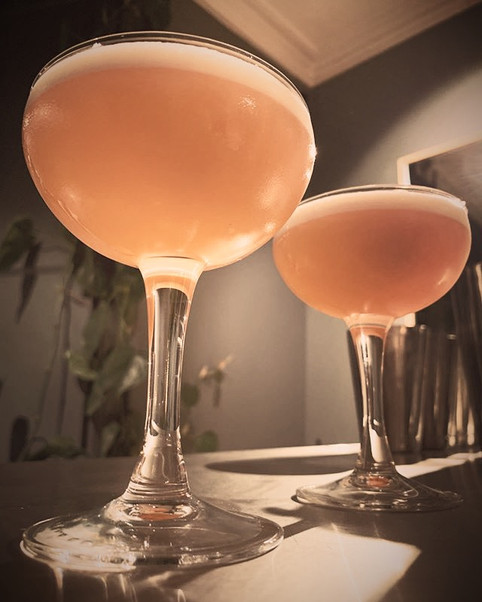
Where is `white wall`? Image resolution: width=482 pixels, height=602 pixels. white wall is located at coordinates (253, 309).